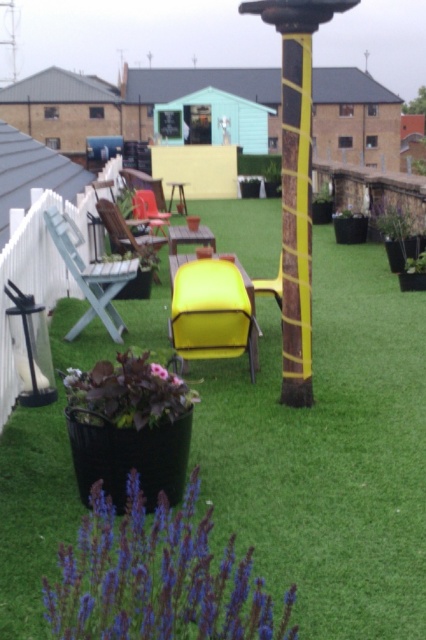
Who is higher up, purple matte flower at lower center or matte red chair at center?

Positioned higher is matte red chair at center.

Can you confirm if purple matte flower at lower center is positioned to the left of matte red chair at center?

Incorrect, purple matte flower at lower center is not on the left side of matte red chair at center.

What do you see at coordinates (157, 577) in the screenshot? This screenshot has height=640, width=426. I see `purple matte flower at lower center` at bounding box center [157, 577].

Where is `purple matte flower at lower center`? The height and width of the screenshot is (640, 426). purple matte flower at lower center is located at coordinates coord(157,577).

Which is behind, point (157, 248) or point (166, 220)?

The point (166, 220) is behind.

Consider the image. Measure the distance between point (x=98, y=202) and camera.

Point (x=98, y=202) is 12.28 meters away from camera.

Is point (109, 228) more distant than point (157, 216)?

That is False.

Where is `wooden chair at center`? The width and height of the screenshot is (426, 640). wooden chair at center is located at coordinates (126, 232).

Is point (391, 492) farther from camera compared to point (281, 264)?

No, it is in front of (281, 264).

At what (x,y) coordinates should I click in order to perform the action: click on green artificial grass at center. Please return your answer as a coordinate pair (x, y). Image resolution: width=426 pixels, height=640 pixels. Looking at the image, I should click on (328, 452).